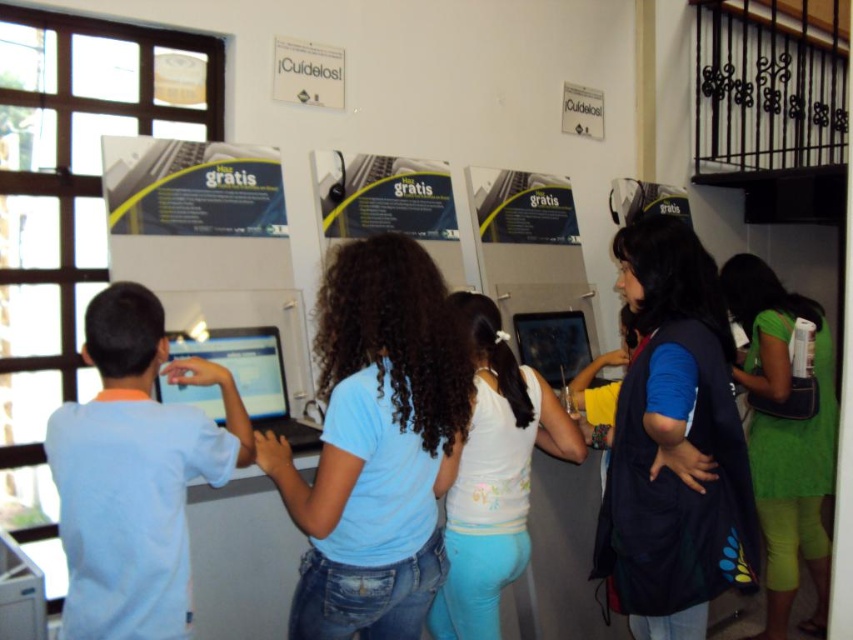
You are a photographer trying to capture a candid shot of the children at the computer station. Since you want to ensure that both the blue cotton shirt at center and the dark blue fabric vest at center right are clearly visible in the photo, which child should be positioned closer to the camera?

The blue cotton shirt at center is in front of the dark blue fabric vest at center right, so to ensure both are visible, position the child wearing the blue cotton shirt at center slightly closer to the camera so that the dark blue fabric vest at center right behind them is still in frame but not obscured.

You are standing in front of the computer station where the children are working. You need to reach the dark blue fabric vest at center right to hand it to someone. Considering your arm length is 0.7 meters, can you reach it without moving closer?

The dark blue fabric vest at center right is 1.73 meters away from the viewer. Since your arm length is only 0.7 meters, you cannot reach it without moving closer.

You are a teacher planning to move a 1.5 meter long table between the dark blue fabric vest at center right and the green fabric dress at right. Is there enough space to fit the table between them?

The dark blue fabric vest at center right is 1.21 meters from the green fabric dress at right, so the 1.5 meter long table would not fit between them since the distance is shorter than the table length.